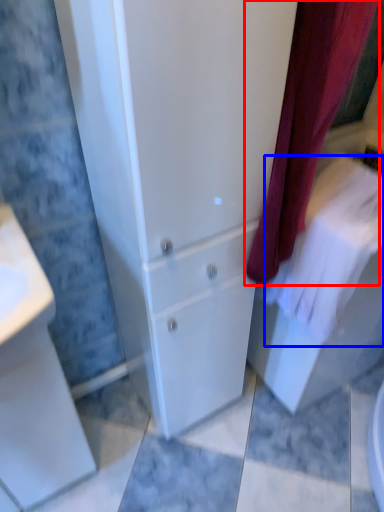
Question: Which of the following is the farthest to the observer, curtain (highlighted by a red box) or bath towel (highlighted by a blue box)?

Choices:
 (A) curtain
 (B) bath towel

Answer: (B)